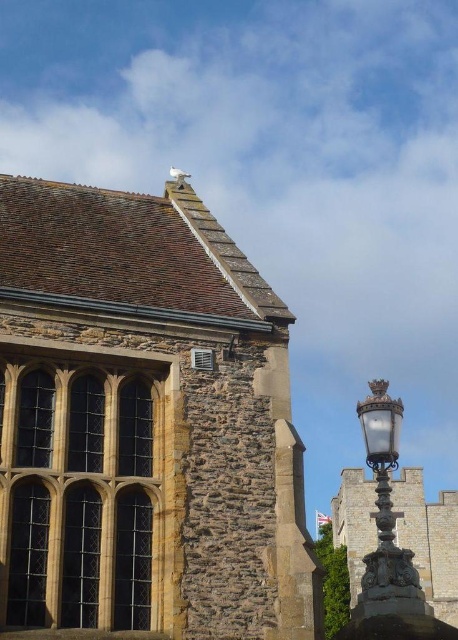
Can you confirm if brown stone church at upper left is bigger than polished brass lamp post at right?

Incorrect, brown stone church at upper left is not larger than polished brass lamp post at right.

Can you confirm if brown stone church at upper left is positioned to the left of polished brass lamp post at right?

Yes, brown stone church at upper left is to the left of polished brass lamp post at right.

This screenshot has height=640, width=458. Find the location of `brown stone church at upper left`. brown stone church at upper left is located at coordinates (145, 426).